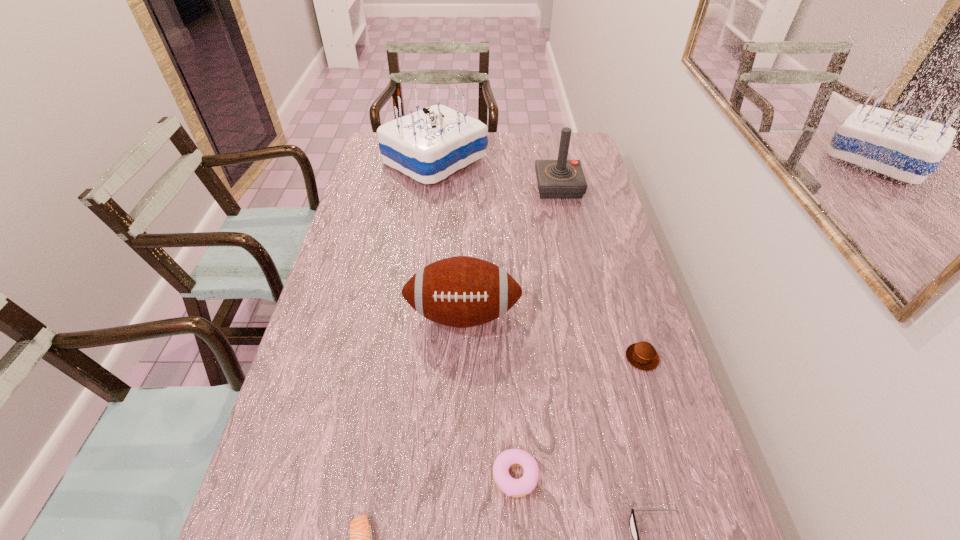
In order to click on vacant region at the left edge of the desktop in this screenshot , I will do `click(382, 173)`.

This screenshot has width=960, height=540. Find the location of `vacant area at the right edge`. vacant area at the right edge is located at coordinates (577, 202).

Find the location of a particular element. This screenshot has height=540, width=960. free space at the far right corner of the desktop is located at coordinates (572, 134).

The height and width of the screenshot is (540, 960). Find the location of `vacant region between the birthday cake and the fifth shortest object`. vacant region between the birthday cake and the fifth shortest object is located at coordinates (449, 238).

Where is `free point between the birthday cake and the second tallest object`? This screenshot has width=960, height=540. free point between the birthday cake and the second tallest object is located at coordinates (497, 173).

Where is `free space between the second tallest object and the tallest object`? The width and height of the screenshot is (960, 540). free space between the second tallest object and the tallest object is located at coordinates (497, 173).

Where is `vacant space that's between the fourth farthest object and the tallest object`? vacant space that's between the fourth farthest object and the tallest object is located at coordinates (539, 259).

What are the coordinates of `vacant area between the doughnut and the muffin` in the screenshot? It's located at (579, 417).

Point out which object is positioned as the second nearest to the joystick. Please provide its 2D coordinates. Your answer should be formatted as a tuple, i.e. [(x, y)], where the tuple contains the x and y coordinates of a point satisfying the conditions above.

[(461, 291)]

Where is `object that ranks as the fourth closest to the fifth farthest object`? object that ranks as the fourth closest to the fifth farthest object is located at coordinates (642, 355).